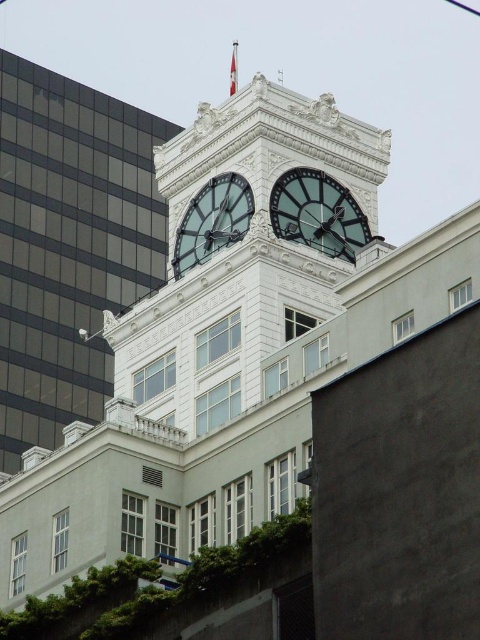
Question: Observing the image, what is the correct spatial positioning of polished brass clock at upper center in reference to matte glass clock at upper center?

Choices:
 (A) above
 (B) below

Answer: (A)

Question: Which object is the farthest from the white marble clock tower at upper center?

Choices:
 (A) polished brass clock at upper center
 (B) matte glass clock at upper center

Answer: (A)

Question: Estimate the real-world distances between objects in this image. Which object is closer to the polished brass clock at upper center?

Choices:
 (A) white marble clock tower at upper center
 (B) matte glass clock at upper center

Answer: (B)

Question: Does white marble clock tower at upper center have a smaller size compared to matte glass clock at upper center?

Choices:
 (A) no
 (B) yes

Answer: (A)

Question: Which point is closer to the camera?

Choices:
 (A) tap(304, 465)
 (B) tap(343, 192)

Answer: (A)

Question: Does white marble clock tower at upper center appear on the left side of matte glass clock at upper center?

Choices:
 (A) no
 (B) yes

Answer: (B)